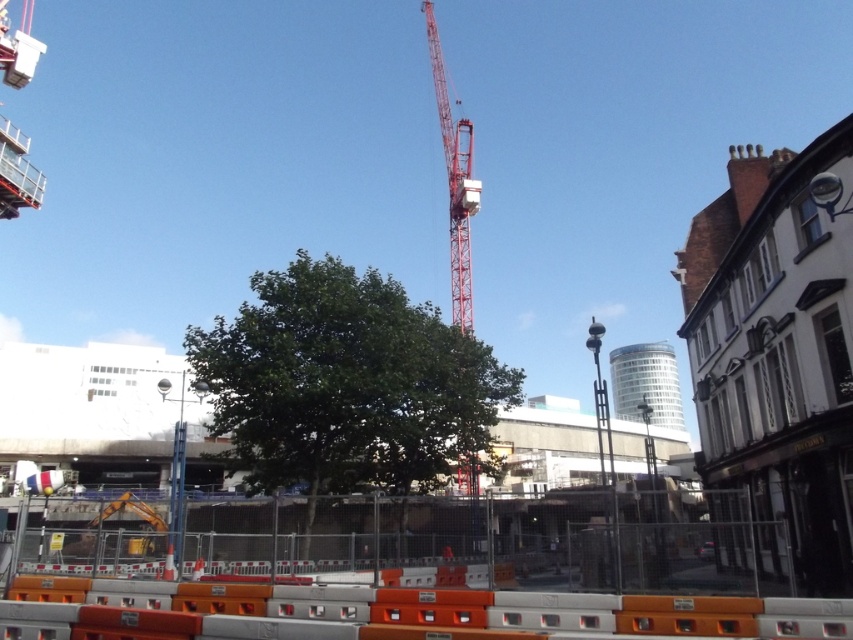
Is orange concrete barriers at center in front of green leafy tree at center?

That is True.

Which of these two, orange concrete barriers at center or green leafy tree at center, stands taller?

green leafy tree at center

The height and width of the screenshot is (640, 853). I want to click on orange concrete barriers at center, so click(x=421, y=588).

Who is positioned more to the left, orange concrete barriers at center or red metallic crane at center?

Positioned to the left is orange concrete barriers at center.

Does point (833, 614) come in front of point (467, 198)?

Yes.

Locate an element on the screen. orange concrete barriers at center is located at coordinates (421, 588).

Is green leafy tree at center to the left of red metallic crane at center from the viewer's perspective?

Indeed, green leafy tree at center is positioned on the left side of red metallic crane at center.

From the picture: Which of these two, green leafy tree at center or red metallic crane at center, stands shorter?

green leafy tree at center

Does point (369, 310) come in front of point (463, 285)?

That is True.

Where is `green leafy tree at center`? This screenshot has width=853, height=640. green leafy tree at center is located at coordinates (346, 385).